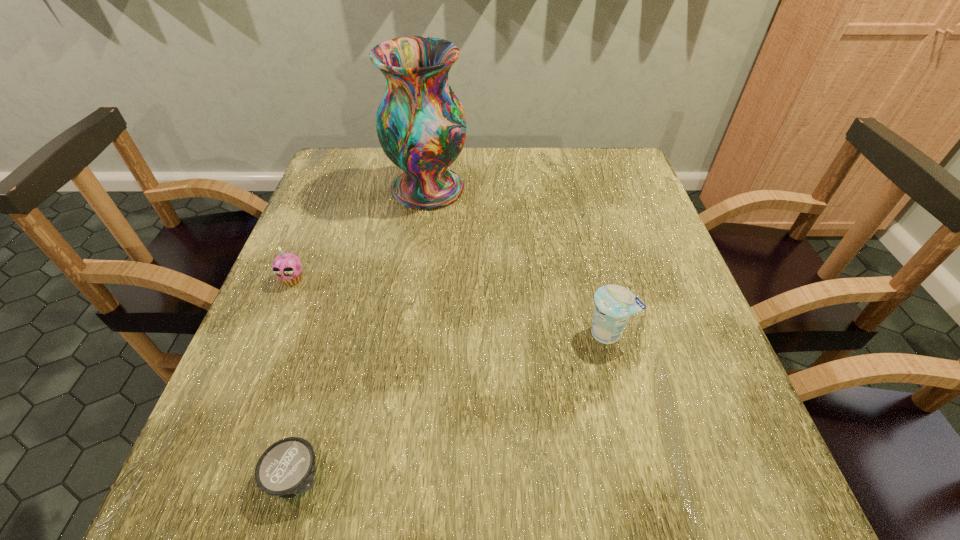
Where is `vacant space that satisfies the following two spatial constraints: 1. on the face of the second farthest object; 2. on the left side of the rightmost object`? The image size is (960, 540). vacant space that satisfies the following two spatial constraints: 1. on the face of the second farthest object; 2. on the left side of the rightmost object is located at coordinates (271, 333).